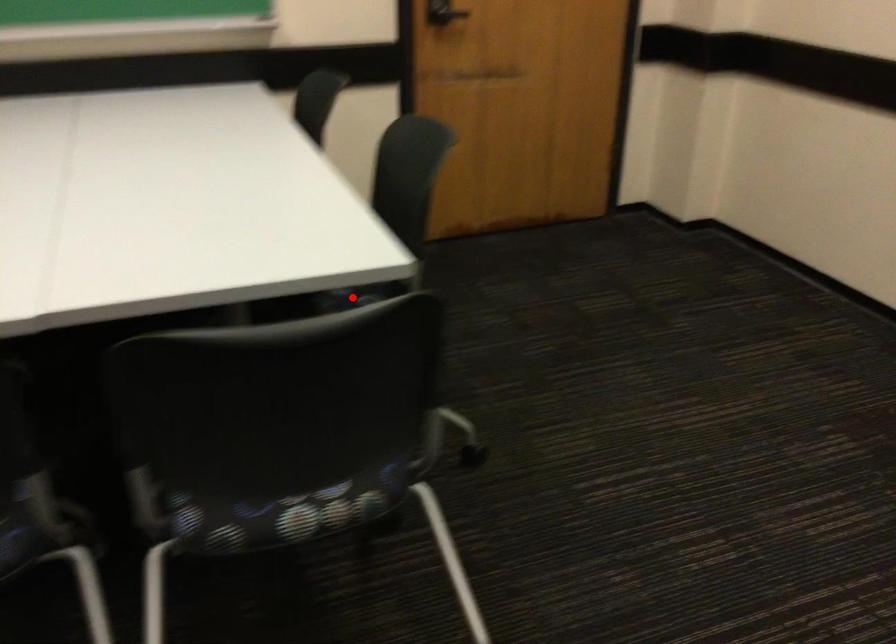
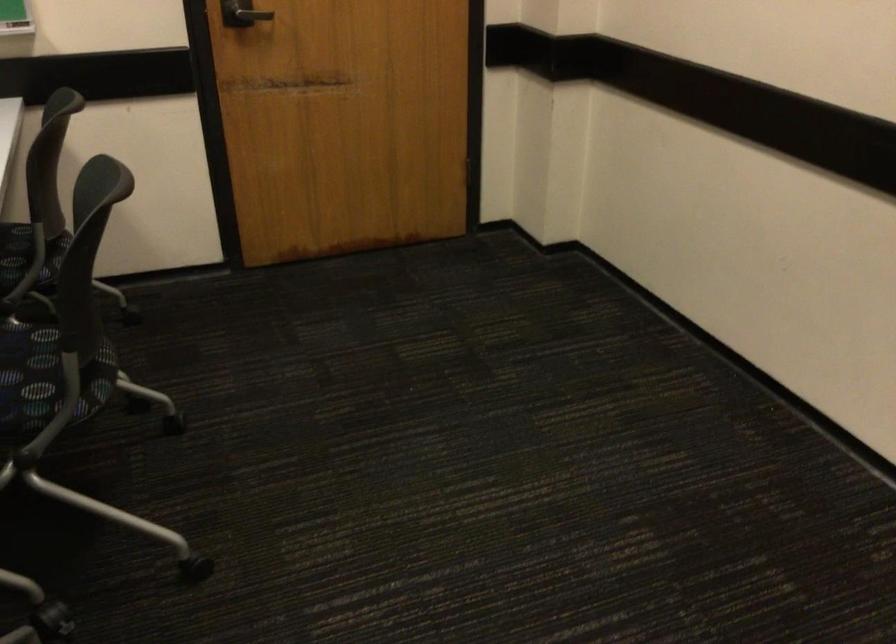
Where in the second image is the point corresponding to the highlighted location from the first image?

(47, 374)